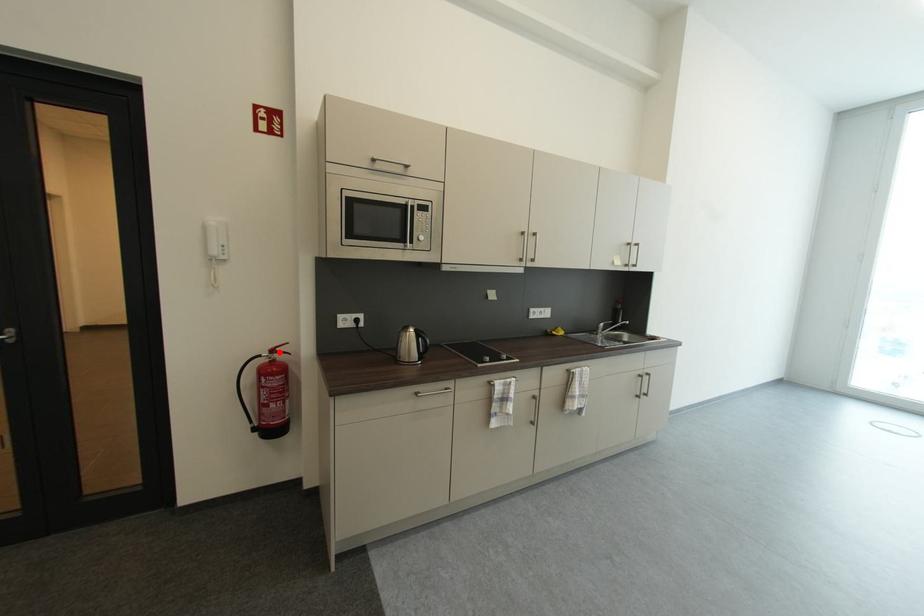
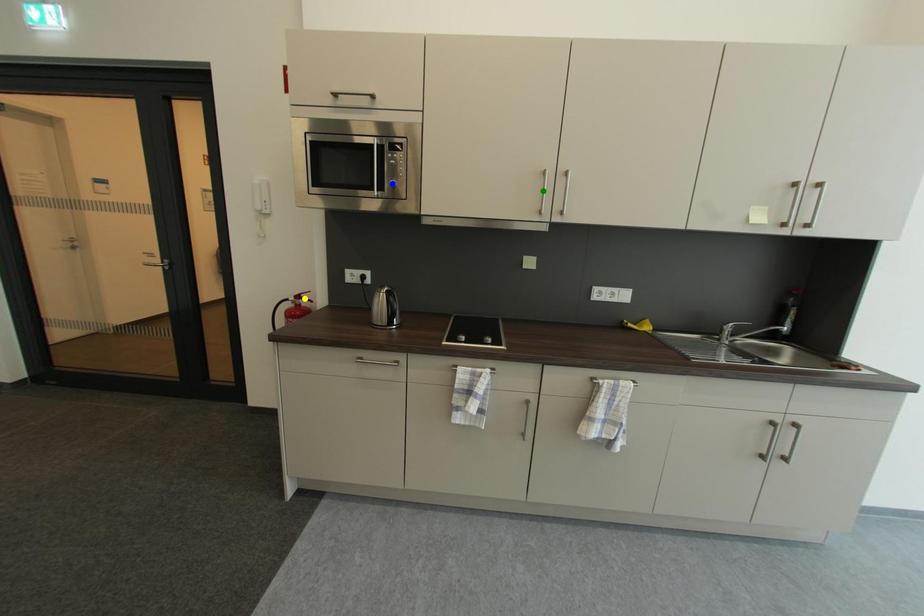
Question: I am providing you with two images of the same scene from different viewpoints. A red point is marked on the first image. You are given multiple points on the second image. In image 2, which mark is for the same physical point as the one in image 1?

Choices:
 (A) blue point
 (B) green point
 (C) yellow point

Answer: (C)